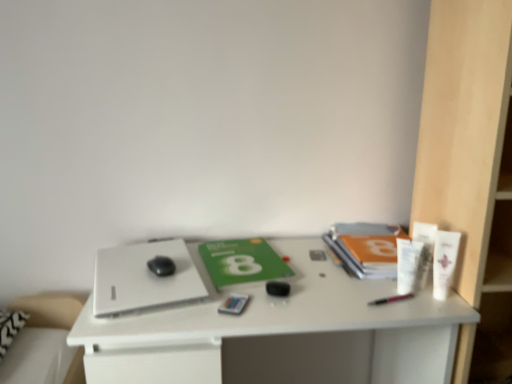
The width and height of the screenshot is (512, 384). I want to click on vacant space behind black plastic pen at center, arranged as the 1th stationery when viewed from the right, so [357, 276].